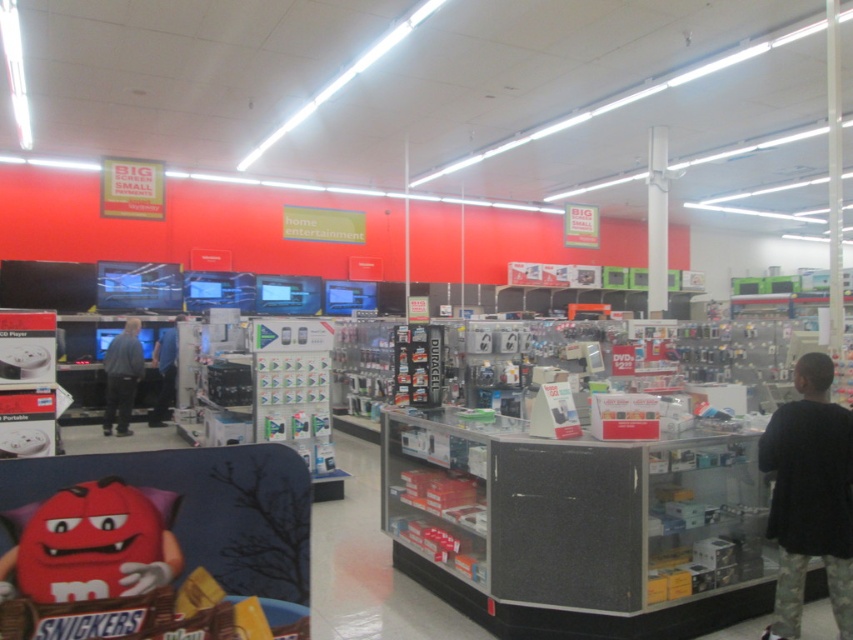
You are a customer in the electronics store and you want to grab both the black matte shirt at right and the blue fabric shirt at left. Are they close enough to grab without moving your position?

The distance between the black matte shirt at right and the blue fabric shirt at left is 8.56 meters. Since this distance is quite large, you would need to move your position to reach both shirts.

You are a customer in the electronics store and you see the blue fabric shirt at left and the dark blue jeans at center. Which item is placed higher on the shelf?

The blue fabric shirt at left is located above the dark blue jeans at center, so it is placed higher on the shelf.